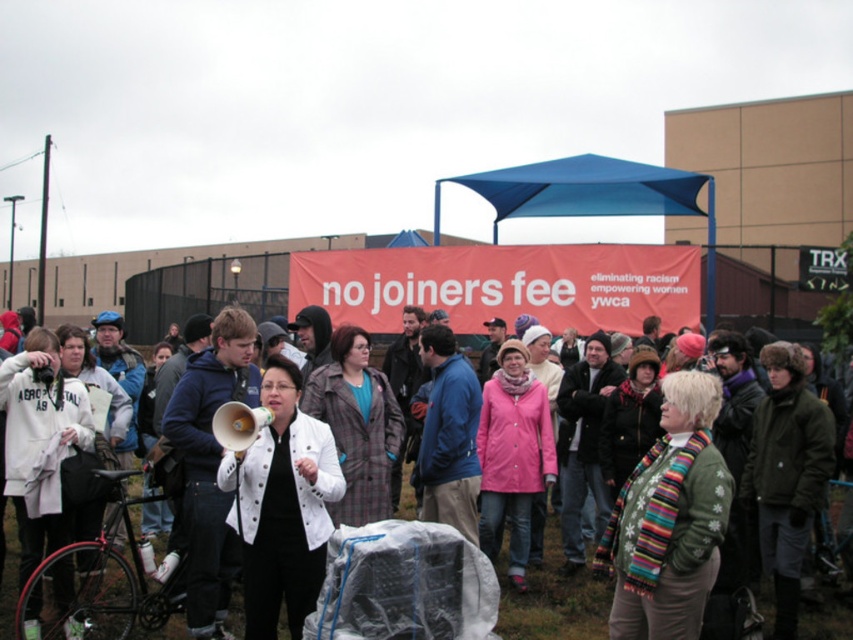
Question: Is blue fleece jacket at center bigger than matte green megaphone at center?

Choices:
 (A) yes
 (B) no

Answer: (A)

Question: Which object appears closest to the camera in this image?

Choices:
 (A) matte green megaphone at center
 (B) dark blue jacket at center
 (C) blue fleece jacket at center

Answer: (A)

Question: Is blue fleece jacket at center behind dark blue jacket at center?

Choices:
 (A) no
 (B) yes

Answer: (A)

Question: Does blue fleece jacket at center appear on the right side of dark blue jacket at center?

Choices:
 (A) no
 (B) yes

Answer: (A)

Question: Which point appears farthest from the camera in this image?

Choices:
 (A) (212, 586)
 (B) (503, 324)
 (C) (247, 406)

Answer: (B)

Question: Which object appears farthest from the camera in this image?

Choices:
 (A) blue fleece jacket at center
 (B) dark blue jacket at center

Answer: (B)